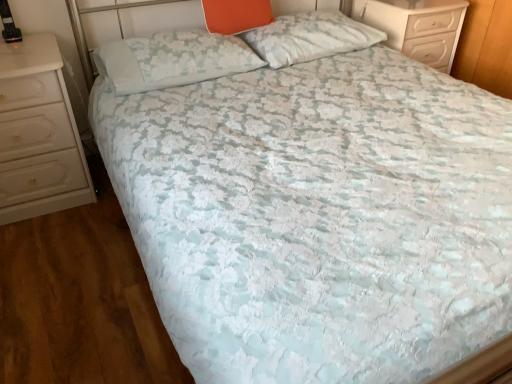
Question: Does orange fabric pillow at upper center, arranged as the 2th pillow when viewed from the left, lie in front of white glossy chest of drawers at upper right, marked as the 2th chest of drawers in a bottom-to-top arrangement?

Choices:
 (A) no
 (B) yes

Answer: (B)

Question: Is orange fabric pillow at upper center, which is the 2th pillow in right-to-left order, oriented away from white glossy chest of drawers at upper right, marked as the 2th chest of drawers in a bottom-to-top arrangement?

Choices:
 (A) no
 (B) yes

Answer: (A)

Question: Considering the relative sizes of orange fabric pillow at upper center, arranged as the 2th pillow when viewed from the left, and white glossy chest of drawers at upper right, marked as the 2th chest of drawers in a bottom-to-top arrangement, in the image provided, is orange fabric pillow at upper center, arranged as the 2th pillow when viewed from the left, smaller than white glossy chest of drawers at upper right, marked as the 2th chest of drawers in a bottom-to-top arrangement,?

Choices:
 (A) yes
 (B) no

Answer: (A)

Question: Is orange fabric pillow at upper center, which is the 2th pillow in right-to-left order, behind white glossy chest of drawers at upper right, marked as the 2th chest of drawers in a bottom-to-top arrangement?

Choices:
 (A) yes
 (B) no

Answer: (B)

Question: Is there a large distance between orange fabric pillow at upper center, which is the 2th pillow in right-to-left order, and white glossy chest of drawers at upper right, marked as the first chest of drawers in a top-to-bottom arrangement?

Choices:
 (A) no
 (B) yes

Answer: (A)

Question: Does orange fabric pillow at upper center, which is the 2th pillow in right-to-left order, turn towards white glossy chest of drawers at upper right, arranged as the first chest of drawers when viewed from the right?

Choices:
 (A) yes
 (B) no

Answer: (B)

Question: From a real-world perspective, is white textured pillow at upper center, which is the 1th pillow in left-to-right order, physically below white glossy chest of drawers at upper right, placed as the 1th chest of drawers when sorted from back to front?

Choices:
 (A) yes
 (B) no

Answer: (B)

Question: Considering the relative sizes of white textured pillow at upper center, which is counted as the 3th pillow, starting from the right, and white glossy chest of drawers at upper right, arranged as the first chest of drawers when viewed from the right, in the image provided, is white textured pillow at upper center, which is counted as the 3th pillow, starting from the right, shorter than white glossy chest of drawers at upper right, arranged as the first chest of drawers when viewed from the right,?

Choices:
 (A) no
 (B) yes

Answer: (B)

Question: Can you confirm if white textured pillow at upper center, which is counted as the 3th pillow, starting from the right, is positioned to the right of white glossy chest of drawers at upper right, marked as the first chest of drawers in a top-to-bottom arrangement?

Choices:
 (A) yes
 (B) no

Answer: (B)

Question: From the image's perspective, is white textured pillow at upper center, which is counted as the 3th pillow, starting from the right, on white glossy chest of drawers at upper right, positioned as the second chest of drawers in left-to-right order?

Choices:
 (A) yes
 (B) no

Answer: (B)

Question: Is white glossy chest of drawers at upper right, positioned as the second chest of drawers in left-to-right order, located within white textured pillow at upper center, which is counted as the 3th pillow, starting from the right?

Choices:
 (A) yes
 (B) no

Answer: (B)

Question: From the image's perspective, is white textured pillow at upper center, which is counted as the 3th pillow, starting from the right, under white glossy chest of drawers at upper right, placed as the 1th chest of drawers when sorted from back to front?

Choices:
 (A) no
 (B) yes

Answer: (B)

Question: Is white glossy chest of drawers at left, positioned as the second chest of drawers in right-to-left order, facing away from orange fabric pillow at upper center, which is the 2th pillow in right-to-left order?

Choices:
 (A) no
 (B) yes

Answer: (A)